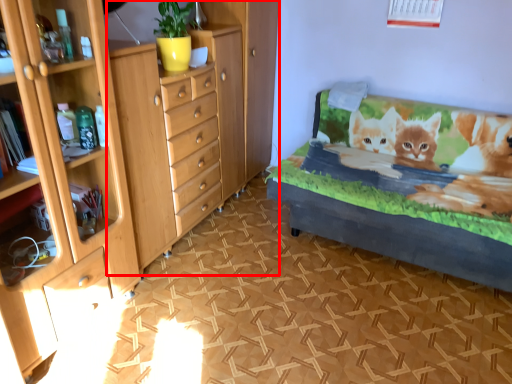
Question: Observing the image, what is the correct spatial positioning of chest of drawers (annotated by the red box) in reference to bed frame?

Choices:
 (A) left
 (B) right

Answer: (A)